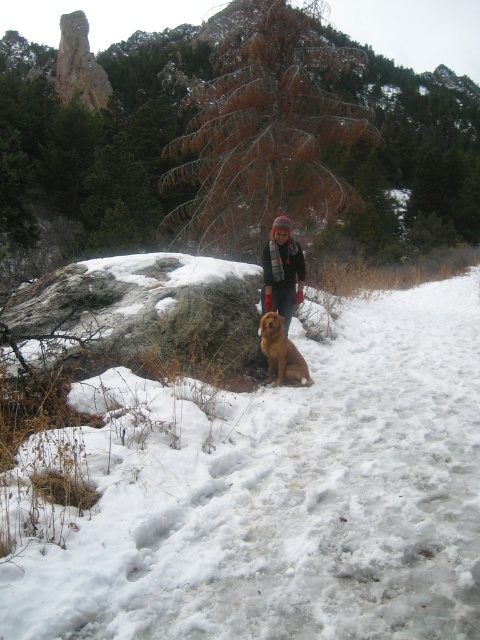
Question: Among these points, which one is nearest to the camera?

Choices:
 (A) (277, 243)
 (B) (162, 540)

Answer: (B)

Question: Does white fluffy snow at center have a smaller size compared to knitted wool hat at center?

Choices:
 (A) no
 (B) yes

Answer: (A)

Question: From the image, what is the correct spatial relationship of knitted wool hat at center in relation to golden fur dog at center?

Choices:
 (A) below
 (B) above

Answer: (B)

Question: Considering the real-world distances, which object is farthest from the knitted wool hat at center?

Choices:
 (A) white fluffy snow at center
 (B) golden fur dog at center

Answer: (A)

Question: Does white fluffy snow at center lie in front of knitted wool hat at center?

Choices:
 (A) yes
 (B) no

Answer: (A)

Question: Considering the real-world distances, which object is farthest from the white fluffy snow at center?

Choices:
 (A) golden fur dog at center
 (B) knitted wool hat at center

Answer: (B)